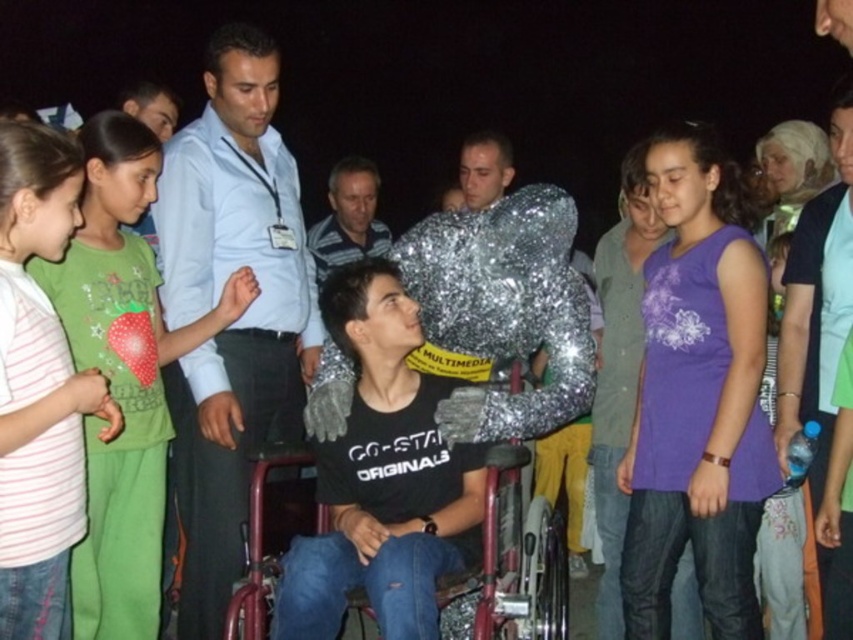
Question: Can you confirm if matte blue shirt at center is smaller than striped cotton shirt at left?

Choices:
 (A) yes
 (B) no

Answer: (B)

Question: Is striped cotton shirt at left further to the viewer compared to metallic red wheelchair at center?

Choices:
 (A) yes
 (B) no

Answer: (B)

Question: Which object is positioned farthest from the metallic red wheelchair at center?

Choices:
 (A) striped cotton shirt at left
 (B) striped shirt at center
 (C) green matte shirt at left

Answer: (B)

Question: Which point is farther to the camera?

Choices:
 (A) striped cotton shirt at left
 (B) green matte shirt at left
 (C) metallic red wheelchair at center

Answer: (B)

Question: Based on their relative distances, which object is farther from the striped shirt at center?

Choices:
 (A) green matte shirt at left
 (B) metallic red wheelchair at center
 (C) matte blue shirt at center

Answer: (B)

Question: Where is matte blue shirt at center located in relation to metallic red wheelchair at center in the image?

Choices:
 (A) above
 (B) below

Answer: (A)